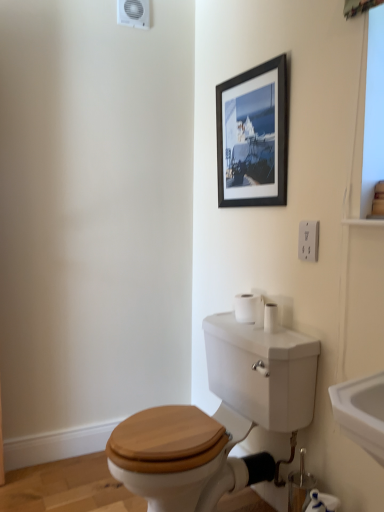
Question: Does white glossy sink at lower right come in front of white matte toilet paper at lower right, which ranks as the 1th toilet paper in bottom-to-top order?

Choices:
 (A) no
 (B) yes

Answer: (B)

Question: Does white glossy sink at lower right turn towards white matte toilet paper at lower right, the 2th toilet paper viewed from the left?

Choices:
 (A) yes
 (B) no

Answer: (B)

Question: Is white glossy sink at lower right behind white matte toilet paper at lower right, which ranks as the 1th toilet paper in bottom-to-top order?

Choices:
 (A) yes
 (B) no

Answer: (B)

Question: Does white glossy sink at lower right have a greater height compared to white matte toilet paper at lower right, the 1th toilet paper in the front-to-back sequence?

Choices:
 (A) no
 (B) yes

Answer: (A)

Question: Considering the relative positions of white glossy sink at lower right and white matte toilet paper at lower right, the second toilet paper positioned from the top, in the image provided, is white glossy sink at lower right to the left of white matte toilet paper at lower right, the second toilet paper positioned from the top, from the viewer's perspective?

Choices:
 (A) no
 (B) yes

Answer: (A)

Question: From a real-world perspective, is white glossy sink at lower right physically below white matte toilet paper at lower right, the 2th toilet paper viewed from the left?

Choices:
 (A) no
 (B) yes

Answer: (A)

Question: Does white plastic electrical outlet at upper right have a greater width compared to wooden toilet seat at center?

Choices:
 (A) no
 (B) yes

Answer: (A)

Question: Is the depth of white plastic electrical outlet at upper right less than that of wooden toilet seat at center?

Choices:
 (A) yes
 (B) no

Answer: (B)

Question: From a real-world perspective, is white plastic electrical outlet at upper right on top of wooden toilet seat at center?

Choices:
 (A) yes
 (B) no

Answer: (A)

Question: Is white plastic electrical outlet at upper right shorter than wooden toilet seat at center?

Choices:
 (A) no
 (B) yes

Answer: (B)

Question: From a real-world perspective, is white plastic electrical outlet at upper right positioned under wooden toilet seat at center based on gravity?

Choices:
 (A) no
 (B) yes

Answer: (A)

Question: Can you confirm if white plastic electrical outlet at upper right is taller than wooden toilet seat at center?

Choices:
 (A) no
 (B) yes

Answer: (A)

Question: Can you confirm if white matte toilet paper at lower right, the second toilet paper positioned from the top, is smaller than white plastic electrical outlet at upper right?

Choices:
 (A) no
 (B) yes

Answer: (A)